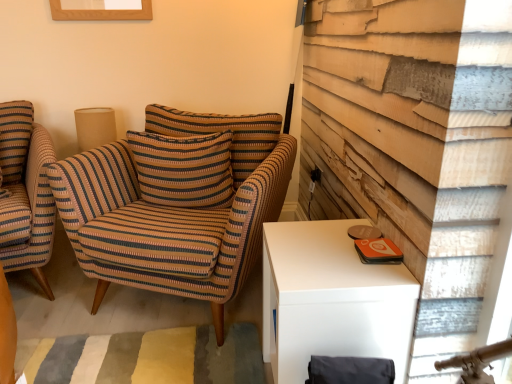
Question: Is striped fabric pillow at center in contact with burlap lampshade at upper left?

Choices:
 (A) no
 (B) yes

Answer: (A)

Question: Does striped fabric pillow at center have a lesser width compared to burlap lampshade at upper left?

Choices:
 (A) no
 (B) yes

Answer: (A)

Question: Is striped fabric pillow at center positioned before burlap lampshade at upper left?

Choices:
 (A) no
 (B) yes

Answer: (B)

Question: Considering the relative sizes of striped fabric pillow at center and burlap lampshade at upper left in the image provided, is striped fabric pillow at center smaller than burlap lampshade at upper left?

Choices:
 (A) yes
 (B) no

Answer: (B)

Question: Does striped fabric pillow at center appear on the left side of burlap lampshade at upper left?

Choices:
 (A) yes
 (B) no

Answer: (B)

Question: Is striped fabric pillow at center at the right side of burlap lampshade at upper left?

Choices:
 (A) yes
 (B) no

Answer: (A)

Question: Considering the relative sizes of striped fabric armchair at left, which is the second chair in right-to-left order, and burlap lampshade at upper left in the image provided, is striped fabric armchair at left, which is the second chair in right-to-left order, bigger than burlap lampshade at upper left?

Choices:
 (A) yes
 (B) no

Answer: (A)

Question: Would you say burlap lampshade at upper left is part of striped fabric armchair at left, arranged as the first chair when viewed from the left,'s contents?

Choices:
 (A) yes
 (B) no

Answer: (B)

Question: Is striped fabric armchair at left, which is the second chair in right-to-left order, to the right of burlap lampshade at upper left from the viewer's perspective?

Choices:
 (A) yes
 (B) no

Answer: (B)

Question: Is striped fabric armchair at left, which is the second chair in right-to-left order, smaller than burlap lampshade at upper left?

Choices:
 (A) no
 (B) yes

Answer: (A)

Question: Does striped fabric armchair at left, arranged as the first chair when viewed from the left, have a greater width compared to burlap lampshade at upper left?

Choices:
 (A) no
 (B) yes

Answer: (B)

Question: Does burlap lampshade at upper left have a larger size compared to striped fabric armchair at center, the second chair when ordered from left to right?

Choices:
 (A) yes
 (B) no

Answer: (B)